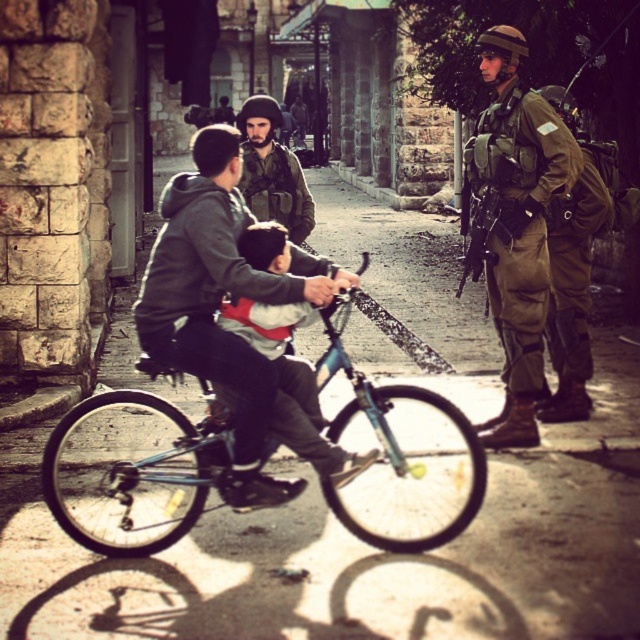
You are a delivery person trying to navigate through the street scene. You need to deliver a package to the address located at point (220,300). According to the image, what object is exactly at that coordinate?

The light blue plastic bicycle at center is located at point (220,300).

You are a delivery person who needs to quickly move your delivery cart from the light blue plastic bicycle at center to the camouflage uniform at right. Is the distance between them sufficient for you to maneuver your cart, which requires at least 2 meters of space?

The distance between the light blue plastic bicycle at center and the camouflage uniform at right is 1.97 meters, which is slightly less than the required 2 meters. Therefore, maneuvering the cart might be challenging and not advisable.

You are a delivery person who needs to pass by the teal matte bicycle at center. There are two soldiers standing on the right side of the street. How far apart are the soldiers from each other?

The two soldiers standing on the right side of the street are 15.04 feet apart.